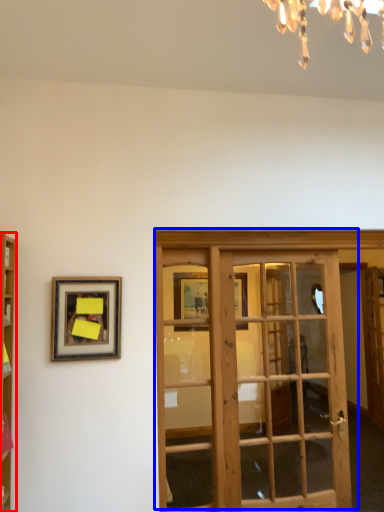
Question: Which object appears farthest to the camera in this image, cabinetry (highlighted by a red box) or door (highlighted by a blue box)?

Choices:
 (A) cabinetry
 (B) door

Answer: (B)